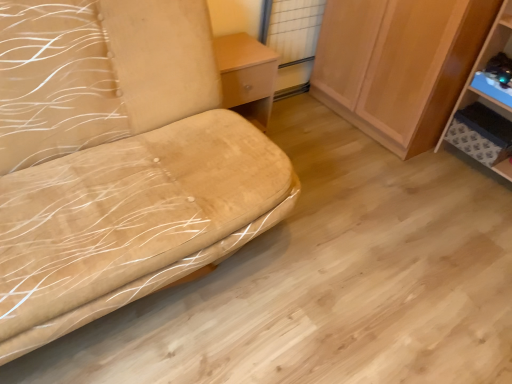
Identify the location of free space between light wood/texture table at center and blue plastic shelf at right. This screenshot has height=384, width=512. (367, 157).